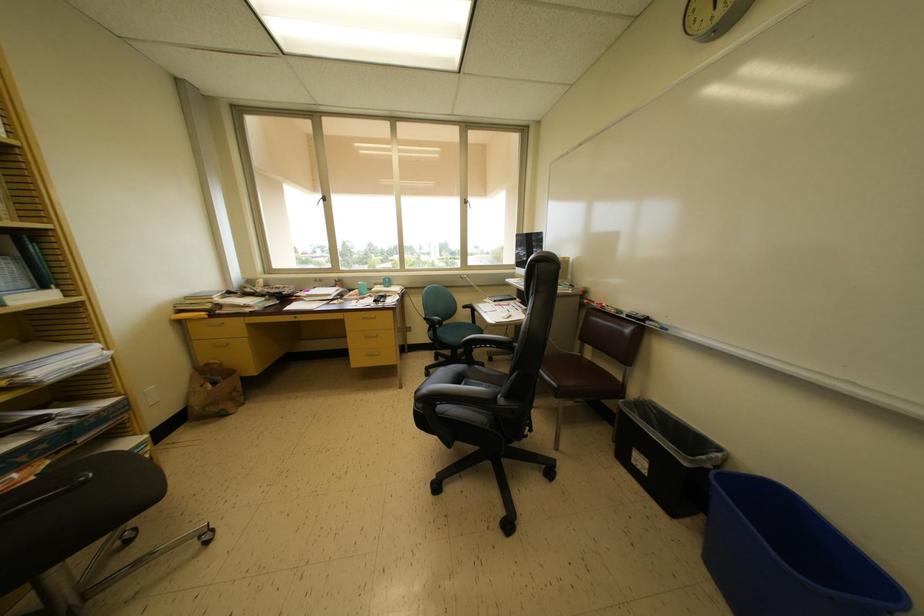
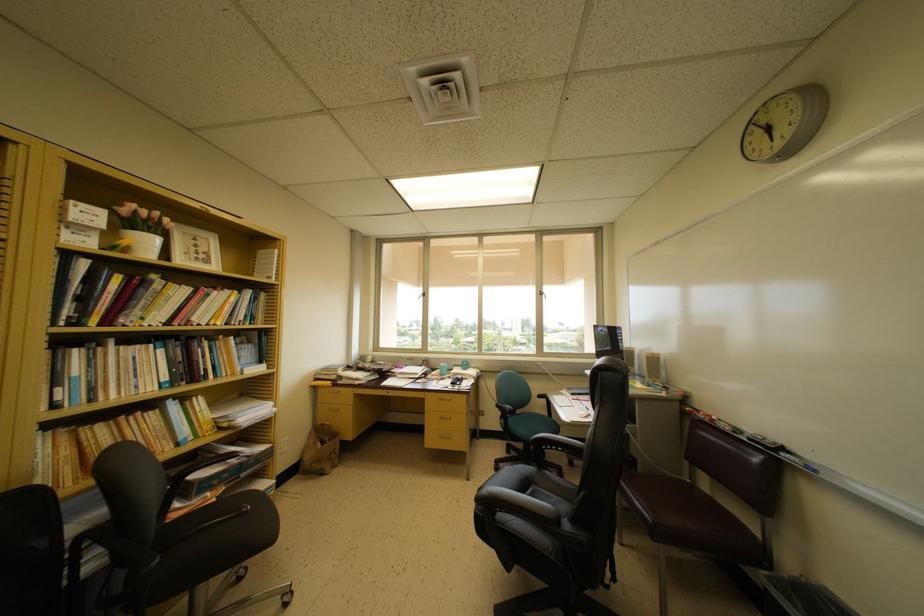
In the second image, find the point that corresponds to [507,345] in the first image.

(582, 450)